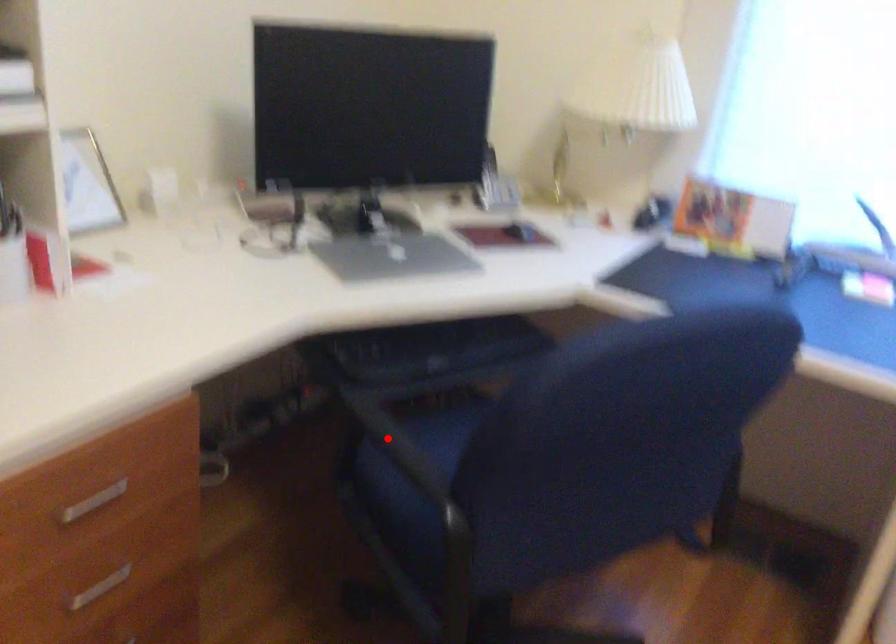
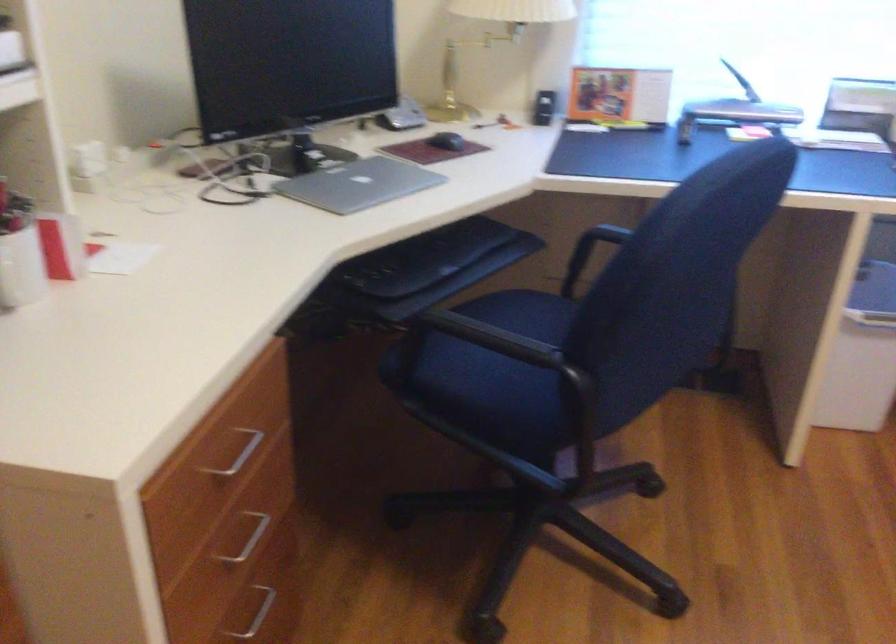
Find the pixel in the second image that matches the highlighted location in the first image.

(478, 339)